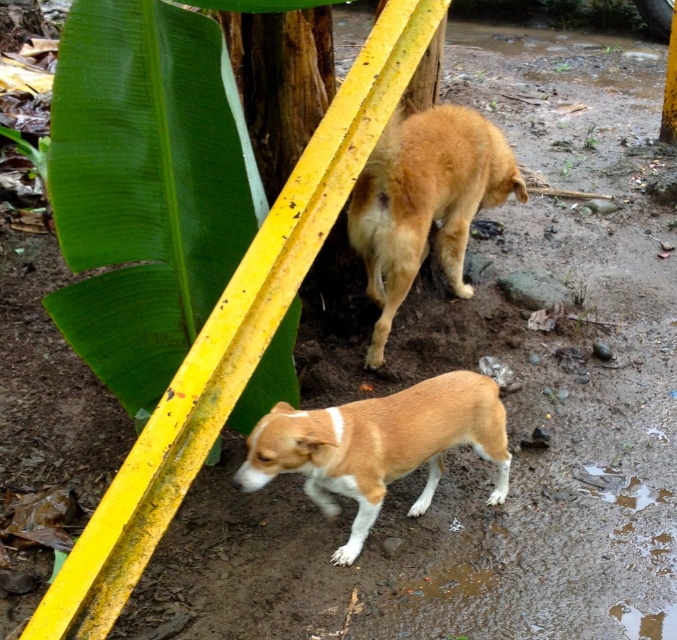
Can you confirm if brown fur dog at center is taller than brown furry dog at center?

No.

Does brown fur dog at center have a lesser width compared to brown furry dog at center?

No, brown fur dog at center is not thinner than brown furry dog at center.

Which is behind, point (389, 451) or point (420, 131)?

Positioned behind is point (420, 131).

The width and height of the screenshot is (677, 640). What are the coordinates of `brown fur dog at center` in the screenshot? It's located at (378, 445).